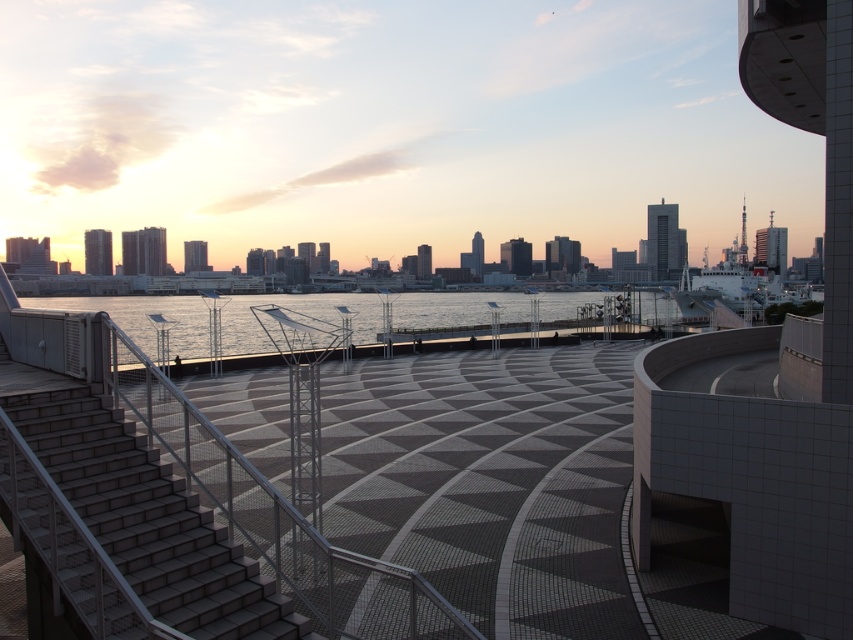
You are standing on the gray concrete stairs at lower left and want to reach the clear water at center. Based on their heights, which one is lower?

The gray concrete stairs at lower left is shorter than clear water at center, so the gray concrete stairs at lower left is lower.